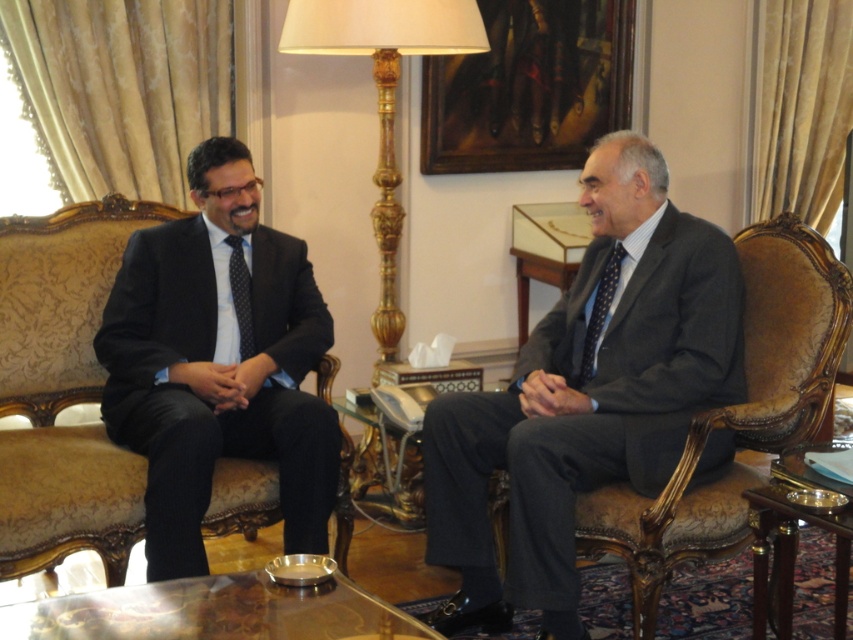
Does dark blue textured tie at right have a lesser height compared to polka dot silk tie at left?

No.

What do you see at coordinates (599, 312) in the screenshot? I see `dark blue textured tie at right` at bounding box center [599, 312].

Image resolution: width=853 pixels, height=640 pixels. In order to click on dark blue textured tie at right in this screenshot , I will do `click(599, 312)`.

Who is positioned more to the right, dark gray textured suit at right or polka dot silk tie at left?

From the viewer's perspective, dark gray textured suit at right appears more on the right side.

Does dark gray textured suit at right appear over polka dot silk tie at left?

No, dark gray textured suit at right is not above polka dot silk tie at left.

Which is in front, point (422, 435) or point (233, 250)?

Point (422, 435) is in front.

You are a GUI agent. You are given a task and a screenshot of the screen. Output one action in this format:
    pyautogui.click(x=<x>, y=<y>)
    Task: Click on the dark gray textured suit at right
    This screenshot has height=640, width=853.
    Given the screenshot: What is the action you would take?
    pos(585,412)

Looking at this image, is dark gray textured suit at right smaller than dark blue textured tie at right?

Actually, dark gray textured suit at right might be larger than dark blue textured tie at right.

Is point (634, 433) positioned behind point (613, 269)?

No, (634, 433) is in front of (613, 269).

You are a GUI agent. You are given a task and a screenshot of the screen. Output one action in this format:
    pyautogui.click(x=<x>, y=<y>)
    Task: Click on the dark gray textured suit at right
    This screenshot has width=853, height=640.
    Given the screenshot: What is the action you would take?
    pyautogui.click(x=585, y=412)